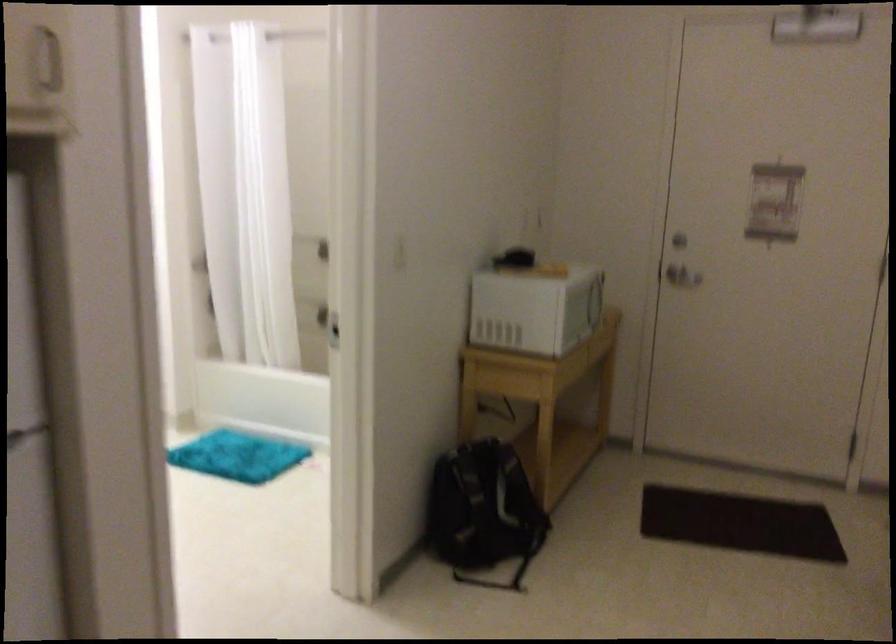
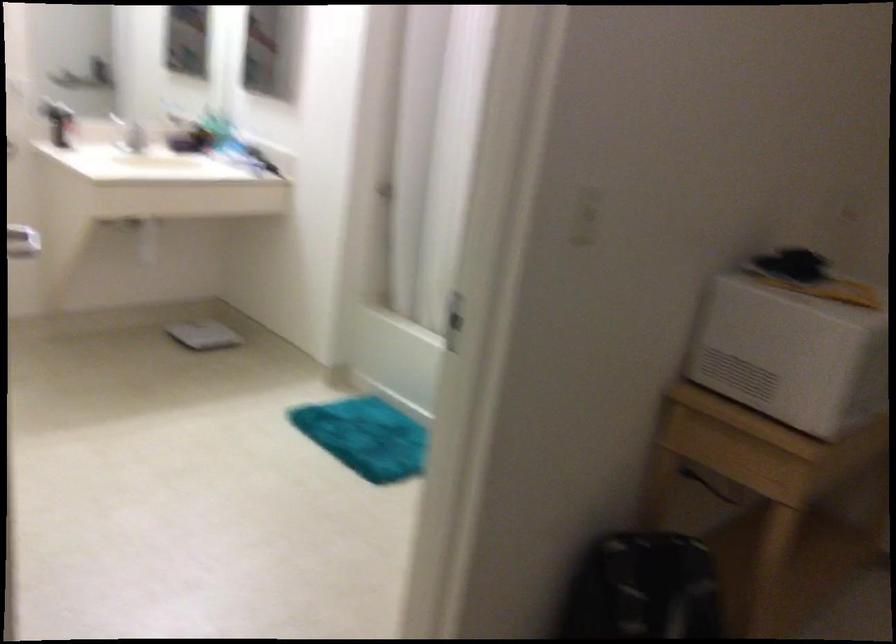
Question: Based on the continuous images, in which direction is the camera rotating? Reply with the corresponding letter.

Choices:
 (A) Left
 (B) Right
 (C) Up
 (D) Down

Answer: (A)